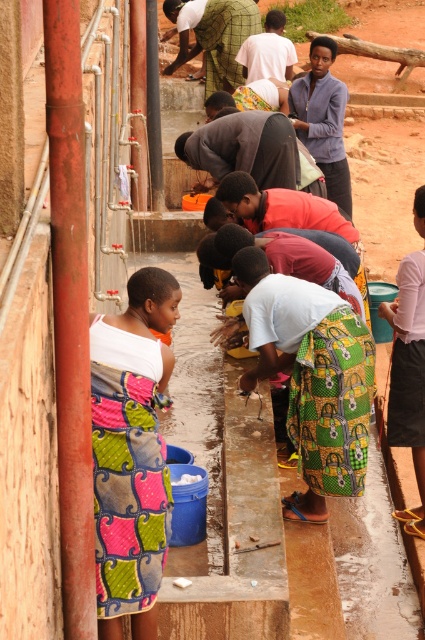
At what (x,y) coordinates should I click in order to perform the action: click on multicolored fabric skirt at lower left. Please return your answer as a coordinate pair (x, y). This screenshot has height=640, width=425. Looking at the image, I should click on (130, 452).

In the scene shown: Can you confirm if multicolored fabric skirt at lower left is positioned above green woven cloth at center?

No, multicolored fabric skirt at lower left is not above green woven cloth at center.

Where is `multicolored fabric skirt at lower left`? multicolored fabric skirt at lower left is located at coordinates (130, 452).

Between pink fabric skirt at lower right and green woven cloth at center, which one is positioned lower?

pink fabric skirt at lower right is lower down.

Between pink fabric skirt at lower right and green woven cloth at center, which one has less height?

green woven cloth at center is shorter.

Between point (396, 413) and point (176, 17), which one is positioned behind?

Point (176, 17)

I want to click on pink fabric skirt at lower right, so pyautogui.click(x=408, y=378).

Can you confirm if multicolored fabric skirt at lower left is smaller than pink fabric skirt at lower right?

No, multicolored fabric skirt at lower left is not smaller than pink fabric skirt at lower right.

From the picture: How much distance is there between multicolored fabric skirt at lower left and pink fabric skirt at lower right?

multicolored fabric skirt at lower left and pink fabric skirt at lower right are 8.70 feet apart from each other.

Which is in front, point (142, 467) or point (391, 371)?

Point (142, 467) is in front.

Identify the location of multicolored fabric skirt at lower left. (130, 452).